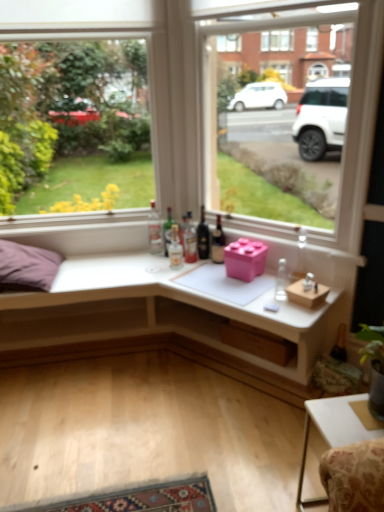
Question: Which is correct: white matte desk at center is inside dark glass bottle at center, which is the 5th bottle in left-to-right order, or outside of it?

Choices:
 (A) inside
 (B) outside

Answer: (B)

Question: Considering the positions of white matte desk at center and dark glass bottle at center, which is the 5th bottle in left-to-right order, in the image, is white matte desk at center bigger or smaller than dark glass bottle at center, which is the 5th bottle in left-to-right order,?

Choices:
 (A) big
 (B) small

Answer: (A)

Question: Which is nearer to the transparent glass window at upper center, which is counted as the second window, starting from the right?

Choices:
 (A) translucent glass bottle at center, marked as the 3th bottle in a left-to-right arrangement
 (B) dark glass bottle at center, the 2th bottle positioned from the right
 (C) translucent glass bottle at center, marked as the sixth bottle in a right-to-left arrangement
 (D) wooden box at right, which appears as the 2th window box when viewed from the top
 (E) clear glass bottle at center, the 7th bottle positioned from the right

Answer: (E)

Question: Which of these objects is positioned closest to the translucent glass bottle at center, the 5th bottle when ordered from right to left?

Choices:
 (A) translucent glass bottle at center, marked as the sixth bottle in a right-to-left arrangement
 (B) transparent glass window at upper center, which is counted as the second window, starting from the right
 (C) dark glass bottle at center, the 2th bottle positioned from the right
 (D) clear glass bottle at center, the 7th bottle positioned from the right
 (E) purple fabric pillow at left

Answer: (A)